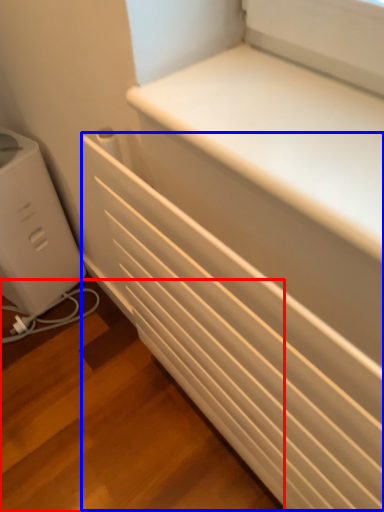
Question: Among these objects, which one is nearest to the camera, stairwell (highlighted by a red box) or radiator (highlighted by a blue box)?

Choices:
 (A) stairwell
 (B) radiator

Answer: (B)